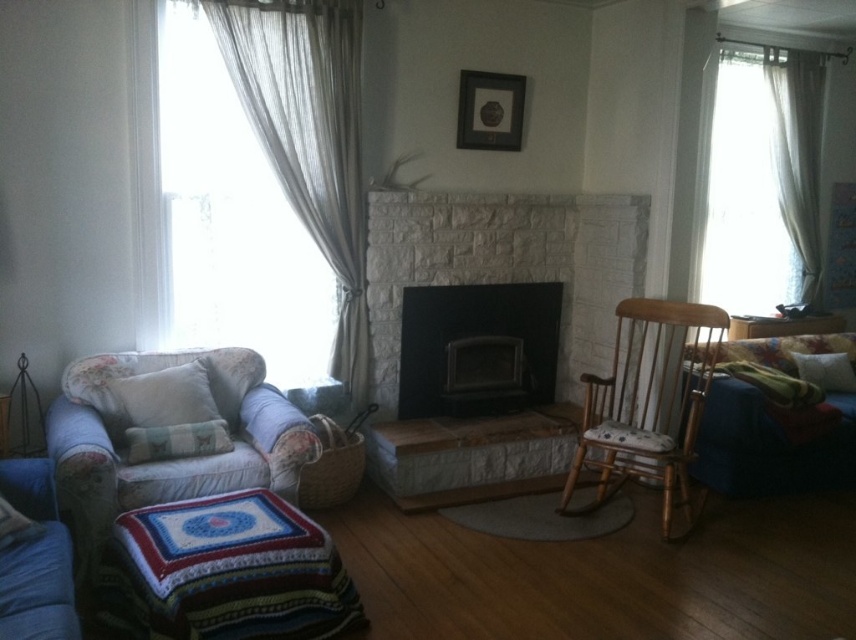
You are standing in the living room and want to open the sheer fabric curtain at left. Based on its position at point 0.216, 0.362, can you estimate where you should walk to reach it?

The sheer fabric curtain at left is located at coordinates 0.216 on the x axis and 0.362 on the y axis, so you should walk towards the left side of the room to reach it.